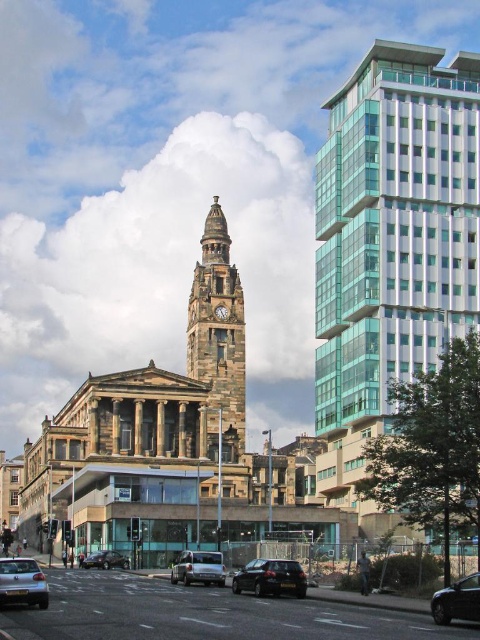
Between glassy teal skyscraper at right and stone clock tower at center, which one appears on the right side from the viewer's perspective?

Positioned to the right is glassy teal skyscraper at right.

Is glassy teal skyscraper at right wider than stone clock tower at center?

Yes.

Between point (435, 122) and point (230, 445), which one is positioned in front?

Positioned in front is point (435, 122).

The height and width of the screenshot is (640, 480). What are the coordinates of `glassy teal skyscraper at right` in the screenshot? It's located at (395, 225).

Is shiny black car at lower right wider than matte black car at center?

In fact, shiny black car at lower right might be narrower than matte black car at center.

Does shiny black car at lower right lie behind matte black car at center?

No, shiny black car at lower right is in front of matte black car at center.

Is point (477, 576) positioned before point (95, 554)?

Yes, point (477, 576) is closer to viewer.

The width and height of the screenshot is (480, 640). I want to click on shiny black car at lower right, so click(456, 602).

Between shiny black car at lower right and green marble clock at center, which one appears on the left side from the viewer's perspective?

green marble clock at center is more to the left.

Is point (454, 609) closer to viewer compared to point (215, 308)?

Yes, it is.

Which is behind, point (465, 605) or point (219, 317)?

The point (219, 317) is more distant.

Locate an element on the screen. The height and width of the screenshot is (640, 480). shiny black car at lower right is located at coordinates (456, 602).